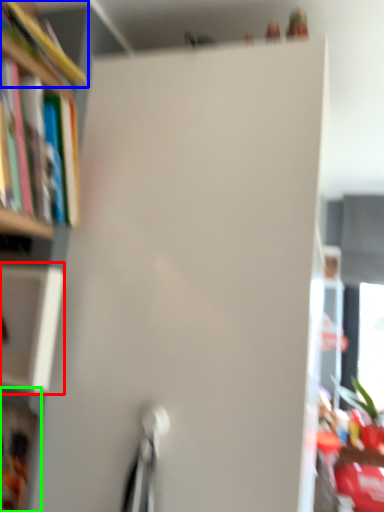
Question: Based on their relative distances, which object is farther from cabinet (highlighted by a red box)? Choose from book (highlighted by a blue box) and cabinet (highlighted by a green box).

Choices:
 (A) book
 (B) cabinet

Answer: (A)